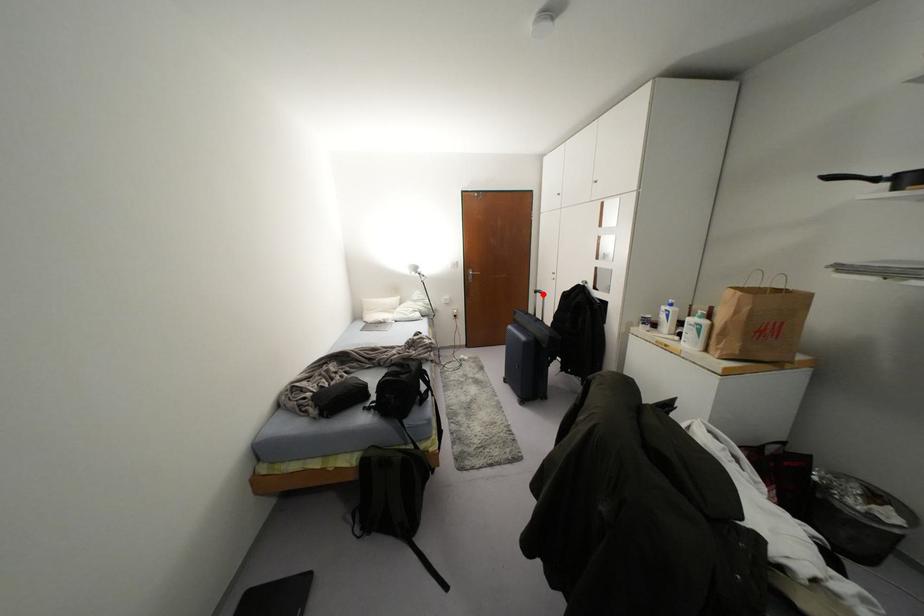
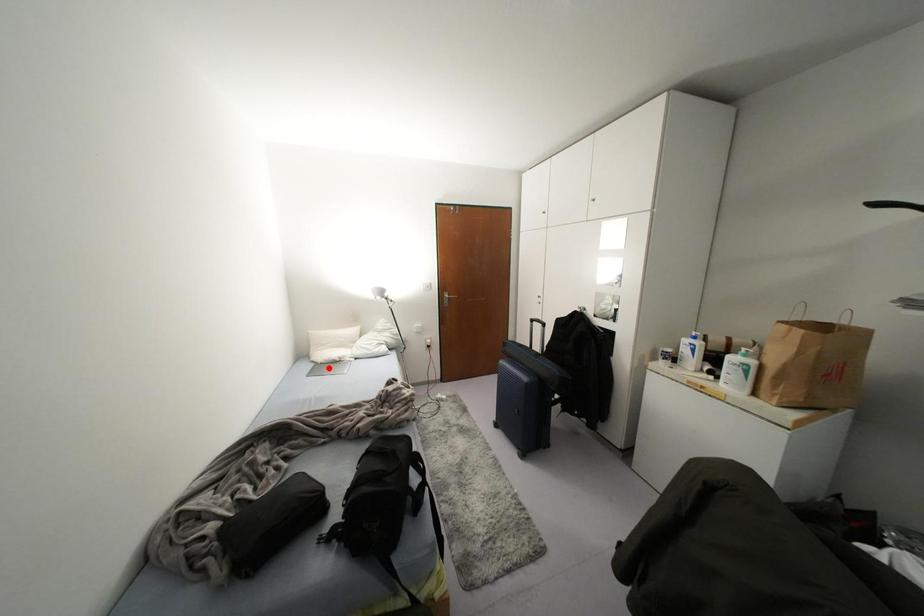
I am providing you with two images of the same scene from different viewpoints. A red point is marked on the first image and another point is marked on the second image. Are the points marked in image1 and image2 representing the same 3D position?

No